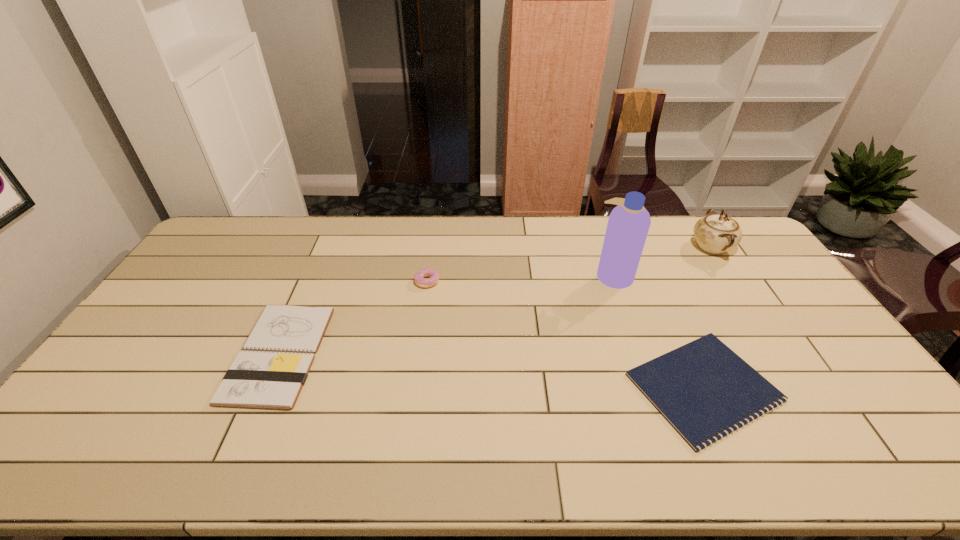
Locate an element on the screen. the tallest object is located at coordinates (628, 224).

Image resolution: width=960 pixels, height=540 pixels. I want to click on the fourth shortest object, so click(715, 234).

What are the coordinates of `the fourth object from right to left` in the screenshot? It's located at (420, 280).

I want to click on the third shortest object, so click(x=420, y=280).

I want to click on the taller notepad, so click(269, 373).

Locate an element on the screen. Image resolution: width=960 pixels, height=540 pixels. the left notepad is located at coordinates (269, 373).

The height and width of the screenshot is (540, 960). I want to click on the shortest object, so click(703, 389).

Identify the location of the right notepad. (703, 389).

Locate an element on the screen. The width and height of the screenshot is (960, 540). blank space located 0.250m on the front of the tallest object is located at coordinates coord(639,350).

Locate an element on the screen. This screenshot has width=960, height=540. vacant space situated 0.150m on the left of the chinaware is located at coordinates (649, 247).